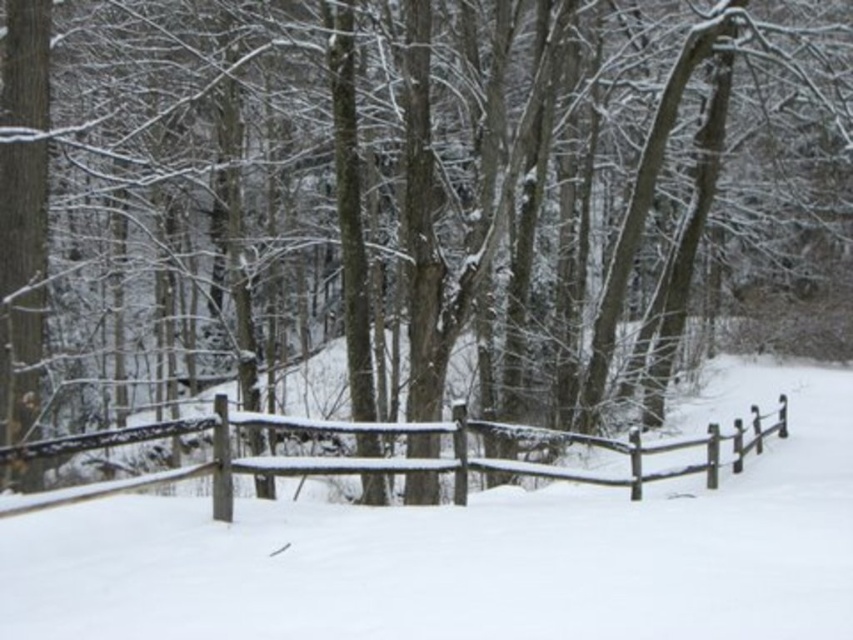
Can you confirm if white matte snow at center is bigger than wooden fence at center?

Actually, white matte snow at center might be smaller than wooden fence at center.

Who is more forward, (767, 486) or (698, 438)?

Point (767, 486) is in front.

What are the coordinates of `white matte snow at center` in the screenshot? It's located at (474, 552).